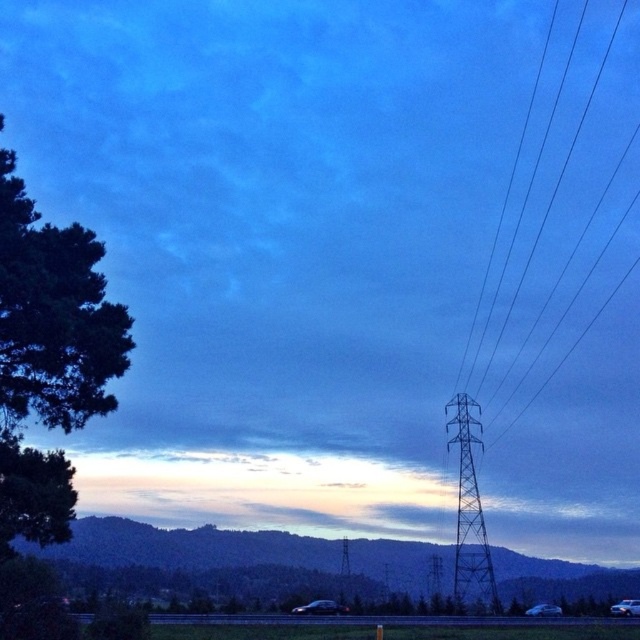
Can you confirm if green leafy tree at left is positioned to the right of black wire at right?

No, green leafy tree at left is not to the right of black wire at right.

Who is more distant from viewer, (28, 476) or (573, 140)?

Positioned behind is point (573, 140).

Is point (61, 465) farther from viewer compared to point (579, 125)?

No, it is not.

Find the location of a particular element. This screenshot has height=640, width=640. green leafy tree at left is located at coordinates (49, 356).

In the scene shown: Is metallic gray telegraph pole at center-right below black wire at right?

Yes.

Who is more distant from viewer, (x=486, y=552) or (x=624, y=3)?

Positioned behind is point (x=624, y=3).

Locate an element on the screen. Image resolution: width=640 pixels, height=640 pixels. metallic gray telegraph pole at center-right is located at coordinates 468,513.

Is green leafy tree at left to the left of metallic gray telegraph pole at center-right from the viewer's perspective?

Indeed, green leafy tree at left is positioned on the left side of metallic gray telegraph pole at center-right.

Is the position of green leafy tree at left less distant than that of metallic gray telegraph pole at center-right?

Yes, it is in front of metallic gray telegraph pole at center-right.

Identify the location of green leafy tree at left. (49, 356).